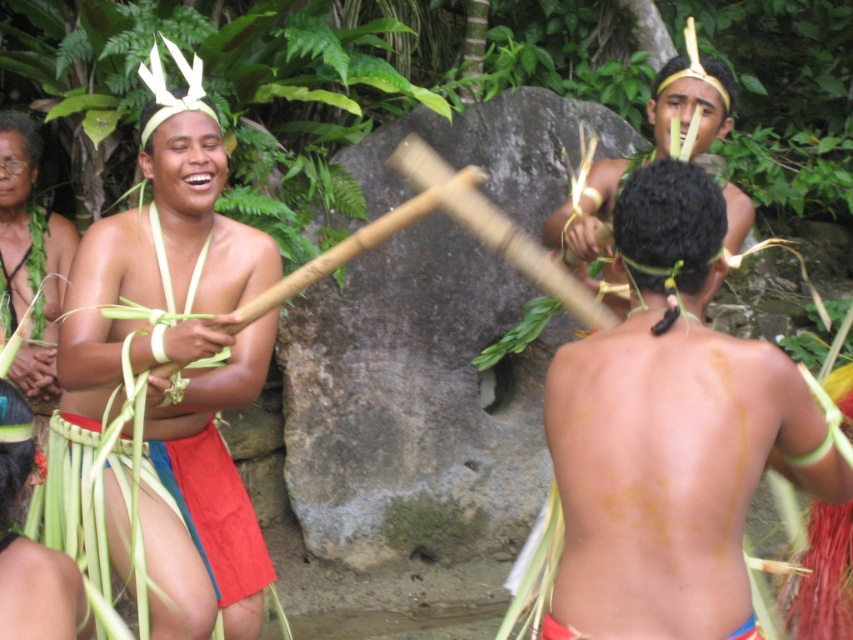
Is point (651, 600) in front of point (728, 77)?

Yes, point (651, 600) is in front of point (728, 77).

How much distance is there between smooth skin at center and smooth brown wooden stick at center?

smooth skin at center is 20.19 inches from smooth brown wooden stick at center.

Which is behind, point (556, 358) or point (680, 76)?

Point (680, 76)

Find the location of a particular element. Image resolution: width=853 pixels, height=640 pixels. smooth skin at center is located at coordinates (671, 435).